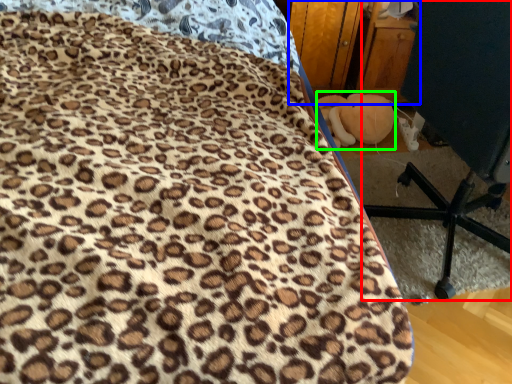
Question: Which object is the closest to the furniture (highlighted by a red box)? Choose among these: dresser (highlighted by a blue box) or toy (highlighted by a green box).

Choices:
 (A) dresser
 (B) toy

Answer: (B)